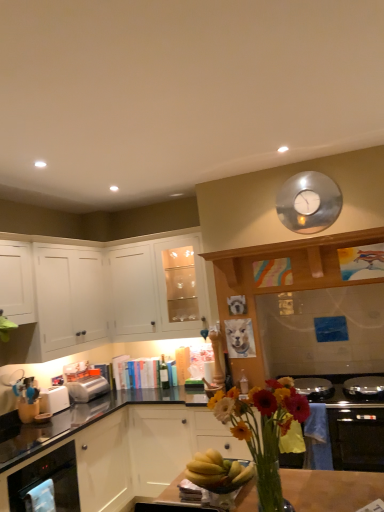
Question: Considering the relative sizes of satin silver toaster at lower left, the first toaster from the back, and white matte cabinet at left, which is the third cabinetry from top to bottom, in the image provided, is satin silver toaster at lower left, the first toaster from the back, shorter than white matte cabinet at left, which is the third cabinetry from top to bottom,?

Choices:
 (A) no
 (B) yes

Answer: (B)

Question: Is satin silver toaster at lower left, the first toaster from the back, positioned before white matte cabinet at left, which is the third cabinetry from top to bottom?

Choices:
 (A) yes
 (B) no

Answer: (B)

Question: From a real-world perspective, is satin silver toaster at lower left, acting as the 2th toaster starting from the front, on top of white matte cabinet at left, which is the first cabinetry in bottom-to-top order?

Choices:
 (A) no
 (B) yes

Answer: (B)

Question: From a real-world perspective, is satin silver toaster at lower left, acting as the 2th toaster starting from the front, below white matte cabinet at left, which is the third cabinetry from top to bottom?

Choices:
 (A) yes
 (B) no

Answer: (B)

Question: From the image's perspective, is satin silver toaster at lower left, the first toaster from the back, located beneath white matte cabinet at left, which is the first cabinetry in bottom-to-top order?

Choices:
 (A) yes
 (B) no

Answer: (B)

Question: Is point (39, 412) positioned closer to the camera than point (122, 261)?

Choices:
 (A) closer
 (B) farther

Answer: (A)

Question: Is white plastic toaster at lower left, the 1th toaster from the front, in front of or behind white matte cabinet at upper left, the first cabinetry viewed from the top, in the image?

Choices:
 (A) behind
 (B) front

Answer: (B)

Question: Considering the positions of white plastic toaster at lower left, the 1th toaster from the front, and white matte cabinet at upper left, the first cabinetry viewed from the top, in the image, is white plastic toaster at lower left, the 1th toaster from the front, wider or thinner than white matte cabinet at upper left, the first cabinetry viewed from the top,?

Choices:
 (A) thin
 (B) wide

Answer: (A)

Question: Choose the correct answer: Is white plastic toaster at lower left, the 1th toaster from the front, inside white matte cabinet at upper left, the first cabinetry viewed from the top, or outside it?

Choices:
 (A) outside
 (B) inside

Answer: (A)

Question: Is white plastic toaster at lower left, the 1th toaster from the front, to the left or to the right of silver metallic clock at upper center in the image?

Choices:
 (A) right
 (B) left

Answer: (B)

Question: From the image's perspective, relative to silver metallic clock at upper center, is white plastic toaster at lower left, the 1th toaster from the front, above or below?

Choices:
 (A) above
 (B) below

Answer: (B)

Question: Is white plastic toaster at lower left, the 1th toaster from the front, situated inside silver metallic clock at upper center or outside?

Choices:
 (A) outside
 (B) inside

Answer: (A)

Question: Is point (49, 396) closer or farther from the camera than point (332, 203)?

Choices:
 (A) closer
 (B) farther

Answer: (B)

Question: From the image's perspective, relative to white matte cabinet at left, which is the first cabinetry in bottom-to-top order, is satin silver toaster at lower left, the first toaster from the back, above or below?

Choices:
 (A) above
 (B) below

Answer: (A)

Question: Looking at the image, does satin silver toaster at lower left, acting as the 2th toaster starting from the front, seem bigger or smaller compared to white matte cabinet at left, which is the first cabinetry in bottom-to-top order?

Choices:
 (A) small
 (B) big

Answer: (A)